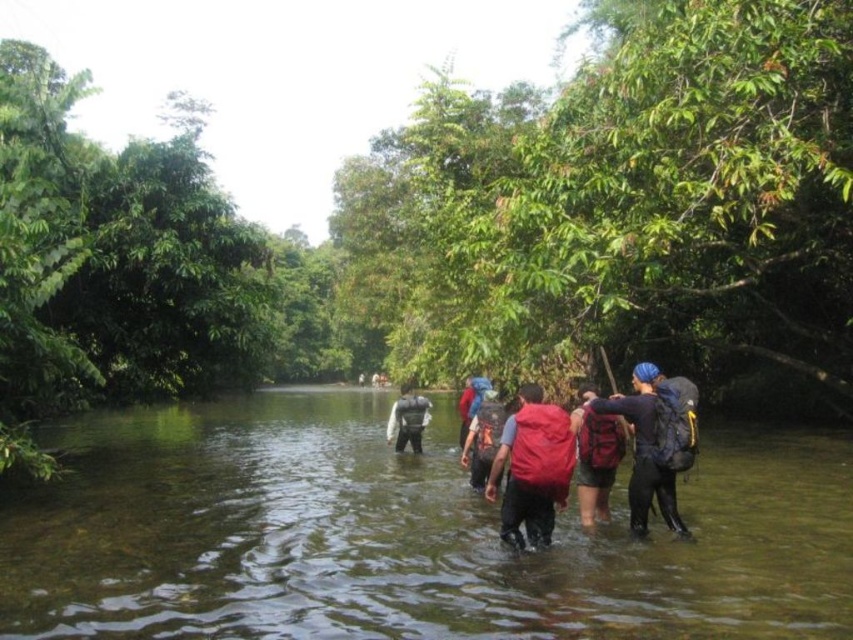
Question: Which point is farther from the camera taking this photo?

Choices:
 (A) (581, 476)
 (B) (399, 451)
 (C) (175, 509)

Answer: (B)

Question: Can you confirm if red matte backpack at center is wider than red backpack at center?

Choices:
 (A) no
 (B) yes

Answer: (B)

Question: Which point appears farthest from the camera in this image?

Choices:
 (A) (277, 492)
 (B) (556, 422)

Answer: (A)

Question: Is red matte backpack at center to the left of red backpack at center from the viewer's perspective?

Choices:
 (A) no
 (B) yes

Answer: (B)

Question: Which object is positioned farthest from the matte black backpack at center?

Choices:
 (A) clear water stream at center
 (B) red backpack at center
 (C) red matte backpack at center
 (D) matte gray backpack at center

Answer: (A)

Question: Can you confirm if clear water stream at center is thinner than matte gray backpack at center?

Choices:
 (A) yes
 (B) no

Answer: (B)